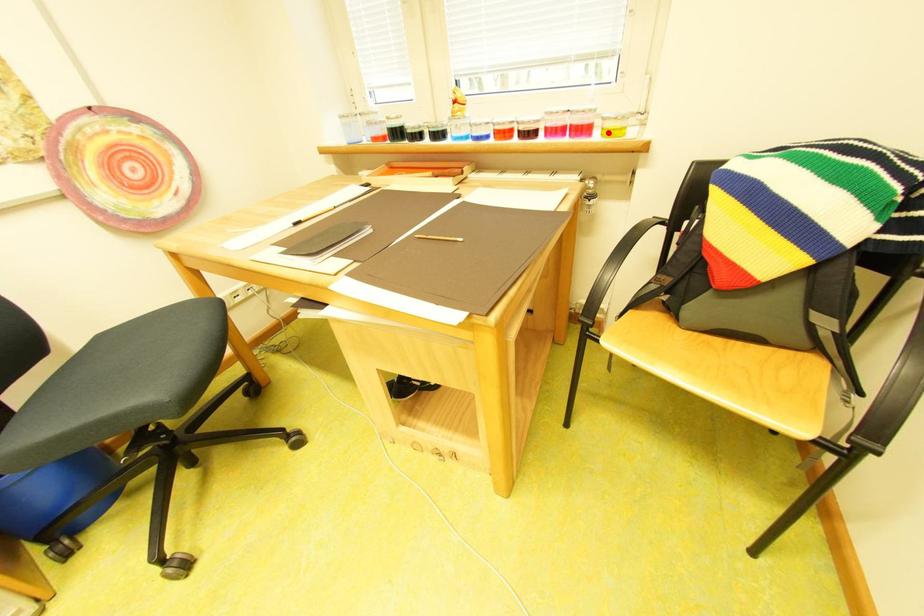
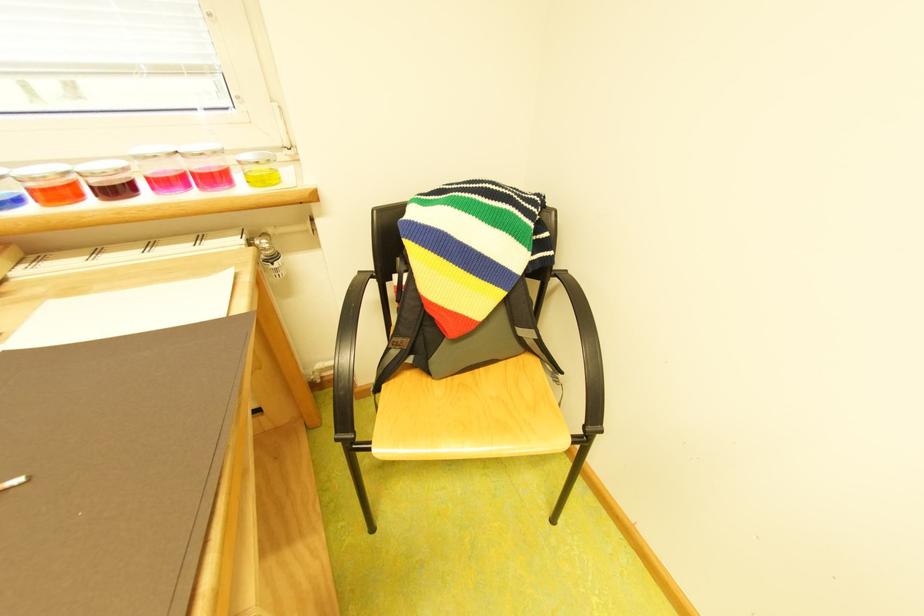
In the second image, find the point that corresponds to the highlighted location in the first image.

(250, 179)